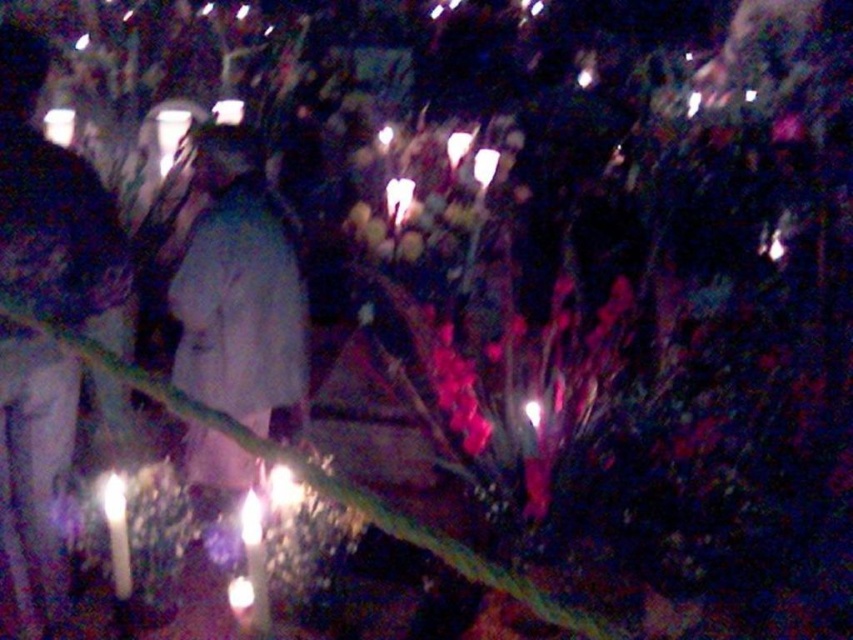
Measure the distance between light gray fabric jacket at left and camera.

They are 6.19 feet apart.

Can you confirm if light gray fabric jacket at left is positioned to the right of white matte coat at center?

Incorrect, light gray fabric jacket at left is not on the right side of white matte coat at center.

Image resolution: width=853 pixels, height=640 pixels. Identify the location of light gray fabric jacket at left. (53, 208).

Can you confirm if light gray fabric jacket at left is positioned above white paper at center?

No.

Is light gray fabric jacket at left further to the viewer compared to white paper at center?

That is False.

Locate an element on the screen. Image resolution: width=853 pixels, height=640 pixels. light gray fabric jacket at left is located at coordinates (53, 208).

The image size is (853, 640). What are the coordinates of `translucent glass candle at lower center` in the screenshot? It's located at pyautogui.click(x=254, y=564).

Which is more to the right, translucent glass candle at lower center or white wax candle at lower left?

translucent glass candle at lower center is more to the right.

Where is `translucent glass candle at lower center`? The width and height of the screenshot is (853, 640). translucent glass candle at lower center is located at coordinates (254, 564).